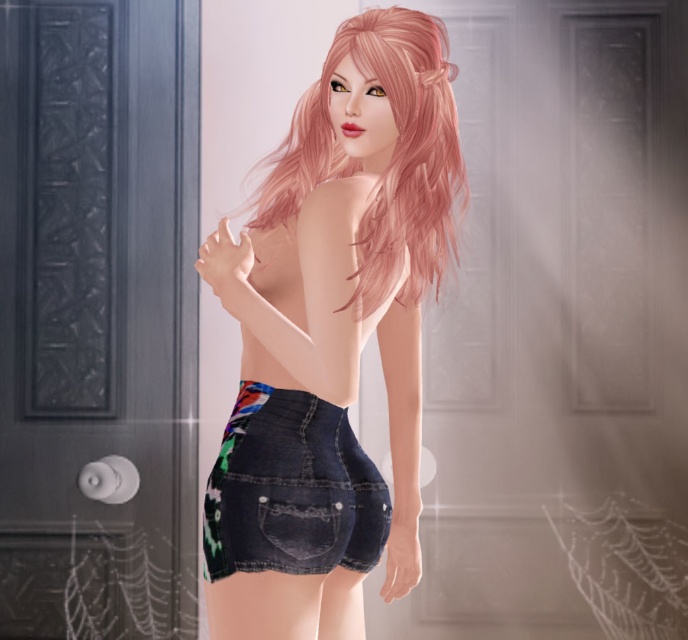
You are an interior designer assessing the layout of a room with a door and a character wearing denim shorts. You need to determine if the denim shorts at center can be placed to the left of the denim shorts at lower center without overlapping. Can they fit side by side horizontally?

The denim shorts at center might be wider than denim shorts at lower center, so it is uncertain if they can fit side by side horizontally without overlapping. Further measurement is needed.

You are an artist trying to draw the character from the front view. Based on the scene, which object from the pink wavy hair at back and denim shorts at lower center should you draw first to maintain proper perspective?

You should draw the pink wavy hair at back first because it is closer to the viewer than the denim shorts at lower center, so it should appear in front in the drawing.